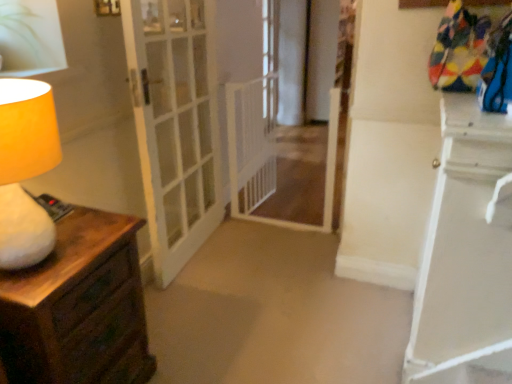
Question: Is white glass door at center oriented towards white glossy nightstand at right?

Choices:
 (A) yes
 (B) no

Answer: (A)

Question: Considering the relative positions of white glass door at center and white glossy nightstand at right in the image provided, is white glass door at center behind white glossy nightstand at right?

Choices:
 (A) yes
 (B) no

Answer: (A)

Question: Is white glass door at center thinner than white glossy nightstand at right?

Choices:
 (A) yes
 (B) no

Answer: (B)

Question: From the image's perspective, does white glass door at center appear lower than white glossy nightstand at right?

Choices:
 (A) yes
 (B) no

Answer: (B)

Question: Can you confirm if white glass door at center is positioned to the right of white glossy nightstand at right?

Choices:
 (A) no
 (B) yes

Answer: (A)

Question: Can you confirm if white glass door at center is wider than white glossy nightstand at right?

Choices:
 (A) no
 (B) yes

Answer: (B)

Question: Does clear glass window at center lie in front of matte yellow lampshade at left?

Choices:
 (A) yes
 (B) no

Answer: (B)

Question: Does clear glass window at center lie behind matte yellow lampshade at left?

Choices:
 (A) no
 (B) yes

Answer: (B)

Question: From a real-world perspective, is clear glass window at center below matte yellow lampshade at left?

Choices:
 (A) no
 (B) yes

Answer: (B)

Question: Considering the relative positions of clear glass window at center and matte yellow lampshade at left in the image provided, is clear glass window at center to the left of matte yellow lampshade at left from the viewer's perspective?

Choices:
 (A) no
 (B) yes

Answer: (A)

Question: Considering the relative sizes of clear glass window at center and matte yellow lampshade at left in the image provided, is clear glass window at center bigger than matte yellow lampshade at left?

Choices:
 (A) no
 (B) yes

Answer: (A)

Question: Can you confirm if clear glass window at center is wider than matte yellow lampshade at left?

Choices:
 (A) yes
 (B) no

Answer: (B)

Question: Considering the relative positions of white mesh gate at center and matte yellow lampshade at left in the image provided, is white mesh gate at center to the right of matte yellow lampshade at left from the viewer's perspective?

Choices:
 (A) no
 (B) yes

Answer: (B)